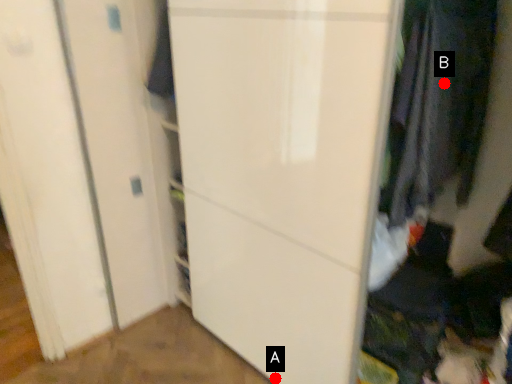
Question: Two points are circled on the image, labeled by A and B beside each circle. Among these points, which one is farthest from the camera?

Choices:
 (A) A is further
 (B) B is further

Answer: (A)